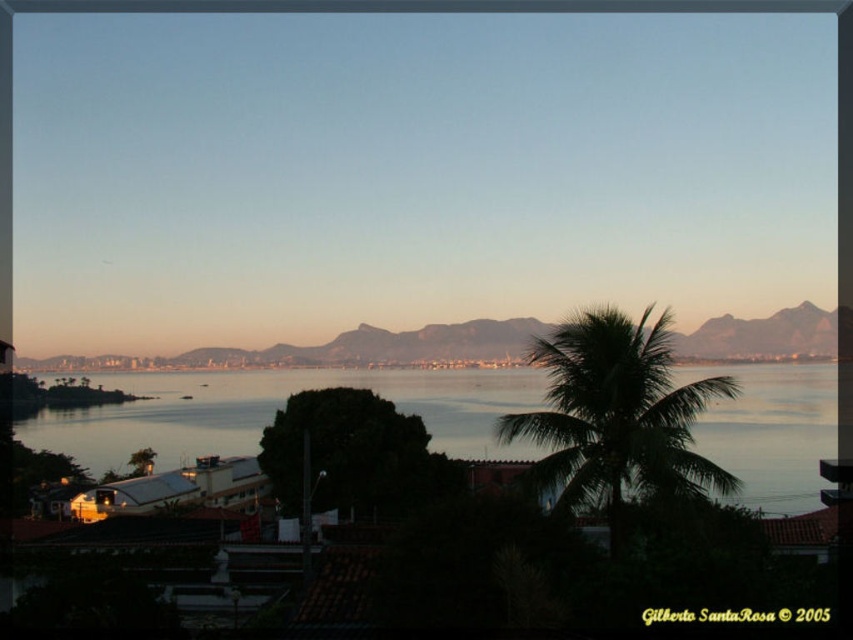
Is clear water at center smaller than green leafy palm tree at center?

No, clear water at center is not smaller than green leafy palm tree at center.

Which of these two, clear water at center or green leafy palm tree at center, stands shorter?

green leafy palm tree at center is shorter.

Between point (402, 412) and point (680, 445), which one is positioned in front?

Point (680, 445) is more forward.

Where is `clear water at center`? clear water at center is located at coordinates (276, 410).

Who is taller, clear water at center or rocky brown mountain at center?

With more height is clear water at center.

Can you confirm if clear water at center is positioned to the left of rocky brown mountain at center?

In fact, clear water at center is to the right of rocky brown mountain at center.

Locate an element on the screen. The image size is (853, 640). clear water at center is located at coordinates (276, 410).

Based on the photo, which is more to the left, blue sky at upper center or green leafy palm tree at center?

blue sky at upper center

Does point (579, 61) come closer to viewer compared to point (698, 493)?

No, (579, 61) is further to viewer.

Is point (350, 84) positioned in front of point (556, 397)?

That is False.

I want to click on blue sky at upper center, so click(x=410, y=172).